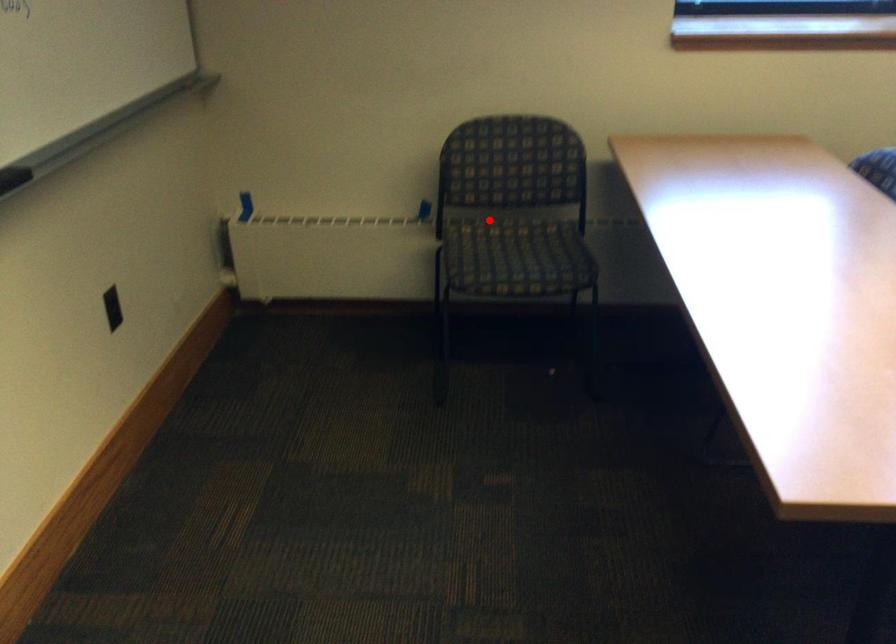
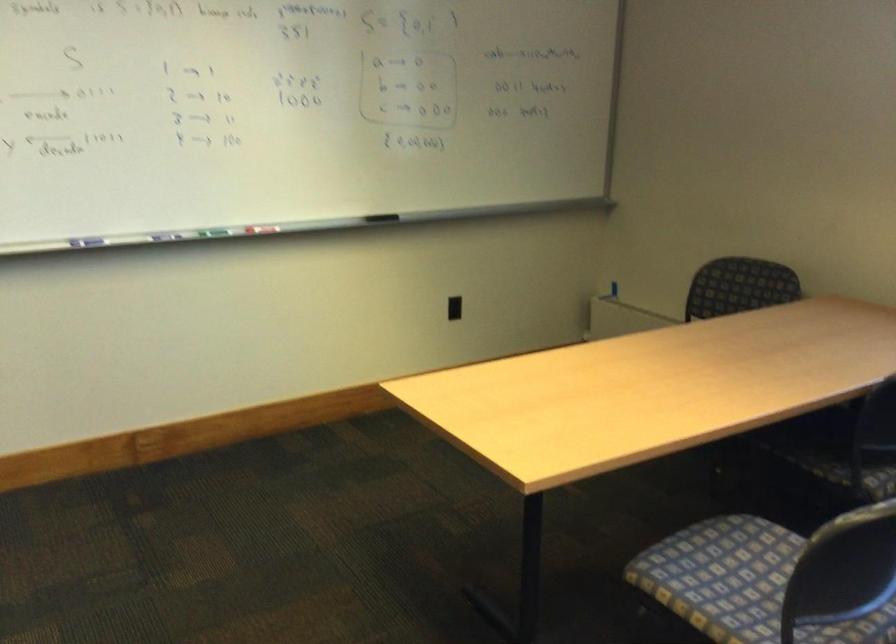
Question: I am providing you with two images of the same scene from different viewpoints. A red point is marked on the first image. At the location where the point appears in image 1, is it still visible in image 2?

Choices:
 (A) Yes
 (B) No

Answer: (B)